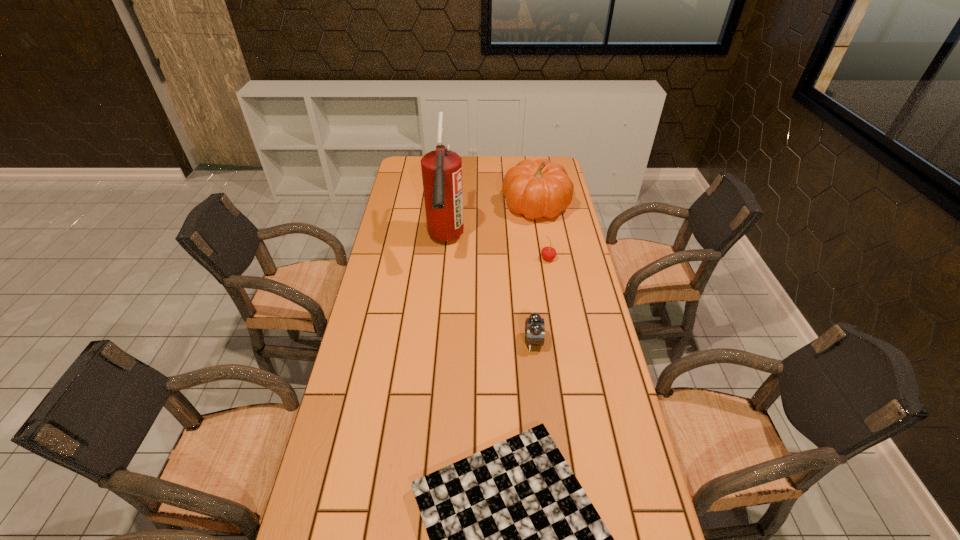
This screenshot has width=960, height=540. In order to click on vacant space that is in between the alarm clock and the fire extinguisher in this screenshot , I will do `click(490, 291)`.

You are a GUI agent. You are given a task and a screenshot of the screen. Output one action in this format:
    pyautogui.click(x=<x>, y=<y>)
    Task: Click on the free space between the pumpkin and the cherry
    The image size is (960, 540).
    Given the screenshot: What is the action you would take?
    pyautogui.click(x=542, y=232)

Identify the location of the fourth closest object to the second tallest object. (514, 539).

You are a GUI agent. You are given a task and a screenshot of the screen. Output one action in this format:
    pyautogui.click(x=<x>, y=<y>)
    Task: Click on the object that is the third closest one to the alarm clock
    
    Given the screenshot: What is the action you would take?
    pyautogui.click(x=441, y=169)